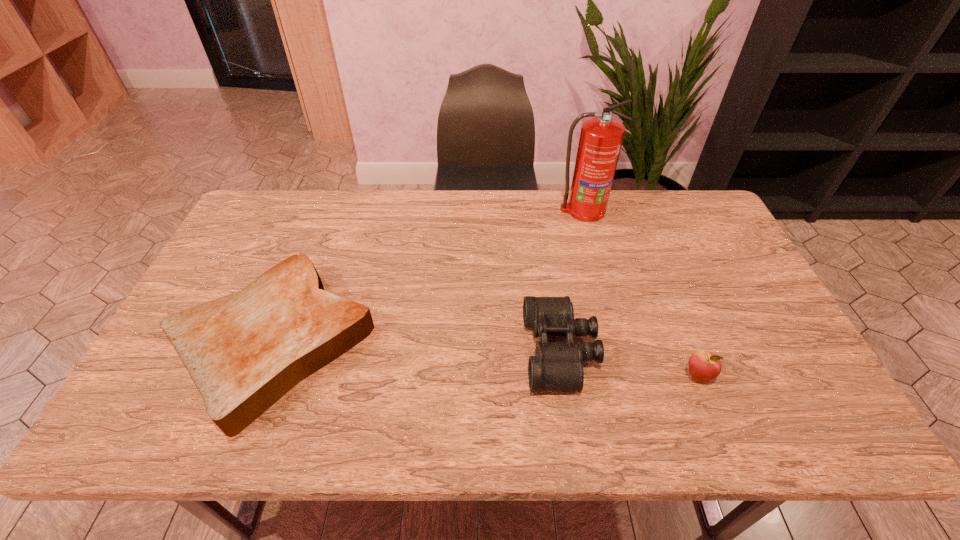
Locate an element on the screen. vacant space that satisfies the following two spatial constraints: 1. on the back side of the rightmost object; 2. at the eyepieces of the binoculars is located at coordinates [687, 351].

Locate an element on the screen. The image size is (960, 540). vacant area that satisfies the following two spatial constraints: 1. on the instruction side of the tallest object; 2. on the left side of the apple is located at coordinates (627, 376).